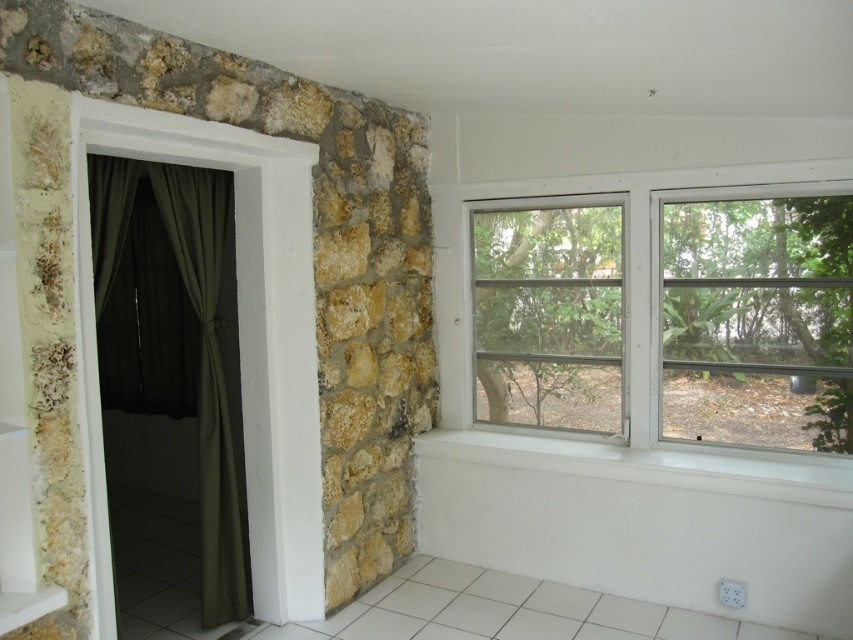
Question: Can you confirm if clear glass window at upper right is positioned above green fabric curtain at left?

Choices:
 (A) yes
 (B) no

Answer: (B)

Question: Is clear glass window at upper right smaller than green fabric curtain at left?

Choices:
 (A) yes
 (B) no

Answer: (B)

Question: Does clear glass window at upper right come behind green fabric curtain at left?

Choices:
 (A) no
 (B) yes

Answer: (A)